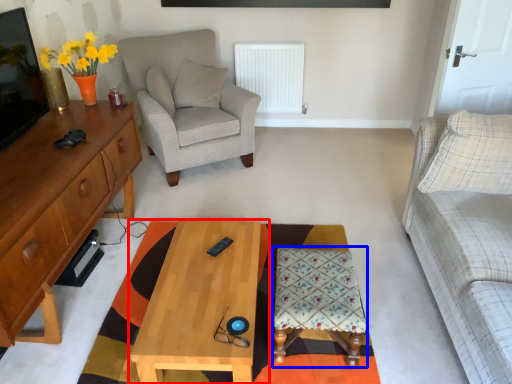
Question: Which object appears closest to the camera in this image, coffee table (highlighted by a red box) or stool (highlighted by a blue box)?

Choices:
 (A) coffee table
 (B) stool

Answer: (A)